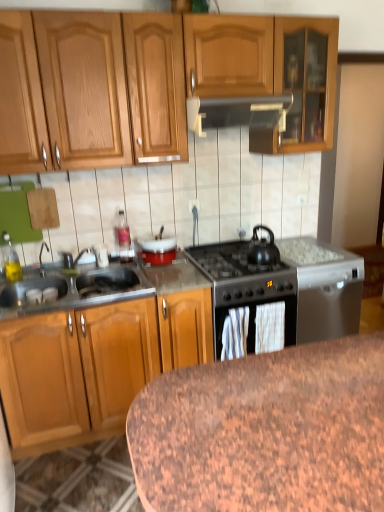
Question: Is brushed metal faucet at sink left touching metallic gray dishwasher at right, which ranks as the 3th appliance in left-to-right order?

Choices:
 (A) no
 (B) yes

Answer: (A)

Question: From a real-world perspective, is brushed metal faucet at sink left over metallic gray dishwasher at right, which ranks as the 3th appliance in left-to-right order?

Choices:
 (A) no
 (B) yes

Answer: (B)

Question: Is brushed metal faucet at sink left aimed at metallic gray dishwasher at right, which is counted as the 1th appliance, starting from the right?

Choices:
 (A) no
 (B) yes

Answer: (A)

Question: Is metallic gray dishwasher at right, which ranks as the 3th appliance in left-to-right order, at the back of brushed metal faucet at sink left?

Choices:
 (A) no
 (B) yes

Answer: (A)

Question: From the image's perspective, is brushed metal faucet at sink left located beneath metallic gray dishwasher at right, which is counted as the 1th appliance, starting from the right?

Choices:
 (A) no
 (B) yes

Answer: (A)

Question: Looking at their shapes, would you say black matte gas stove at center is wider or thinner than brushed metal faucet at sink left?

Choices:
 (A) thin
 (B) wide

Answer: (B)

Question: Is black matte gas stove at center taller or shorter than brushed metal faucet at sink left?

Choices:
 (A) tall
 (B) short

Answer: (B)

Question: From the image's perspective, is black matte gas stove at center above or below brushed metal faucet at sink left?

Choices:
 (A) below
 (B) above

Answer: (A)

Question: From a real-world perspective, relative to brushed metal faucet at sink left, is black matte gas stove at center vertically above or below?

Choices:
 (A) above
 (B) below

Answer: (B)

Question: Is point (170, 237) closer or farther from the camera than point (198, 118)?

Choices:
 (A) closer
 (B) farther

Answer: (B)

Question: Is white glossy bowl at center, which ranks as the 2th appliance in right-to-left order, to the left or to the right of metallic gray range hood at center in the image?

Choices:
 (A) right
 (B) left

Answer: (B)

Question: From a real-world perspective, is white glossy bowl at center, which ranks as the 2th appliance in right-to-left order, positioned above or below metallic gray range hood at center?

Choices:
 (A) above
 (B) below

Answer: (B)

Question: In the image, is white glossy bowl at center, which ranks as the 2th appliance in left-to-right order, positioned in front of or behind metallic gray range hood at center?

Choices:
 (A) behind
 (B) front

Answer: (A)

Question: Is black matte tea pot at center-right in front of or behind white glossy bowl at center, which ranks as the 2th appliance in right-to-left order, in the image?

Choices:
 (A) behind
 (B) front

Answer: (B)

Question: Is point (259, 244) closer or farther from the camera than point (165, 242)?

Choices:
 (A) closer
 (B) farther

Answer: (A)